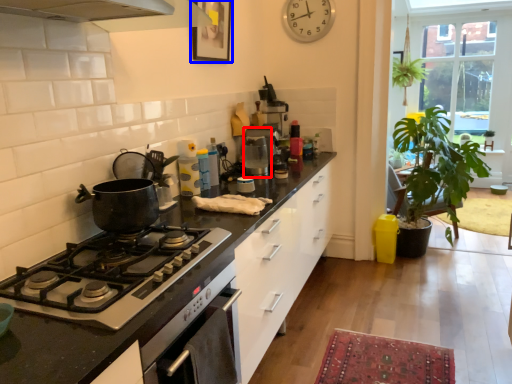
Question: Among these objects, which one is farthest to the camera, coffee machine (highlighted by a red box) or picture frame (highlighted by a blue box)?

Choices:
 (A) coffee machine
 (B) picture frame

Answer: (A)